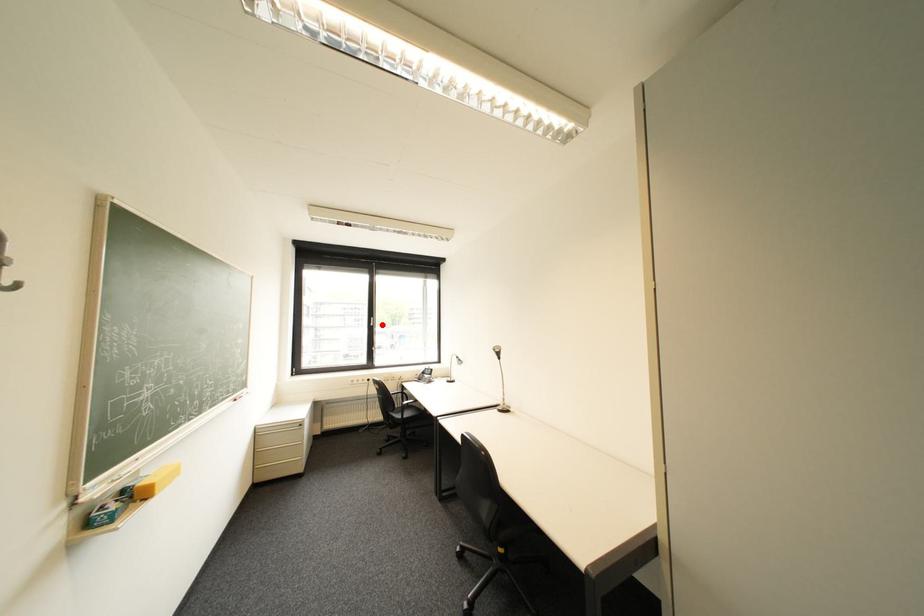
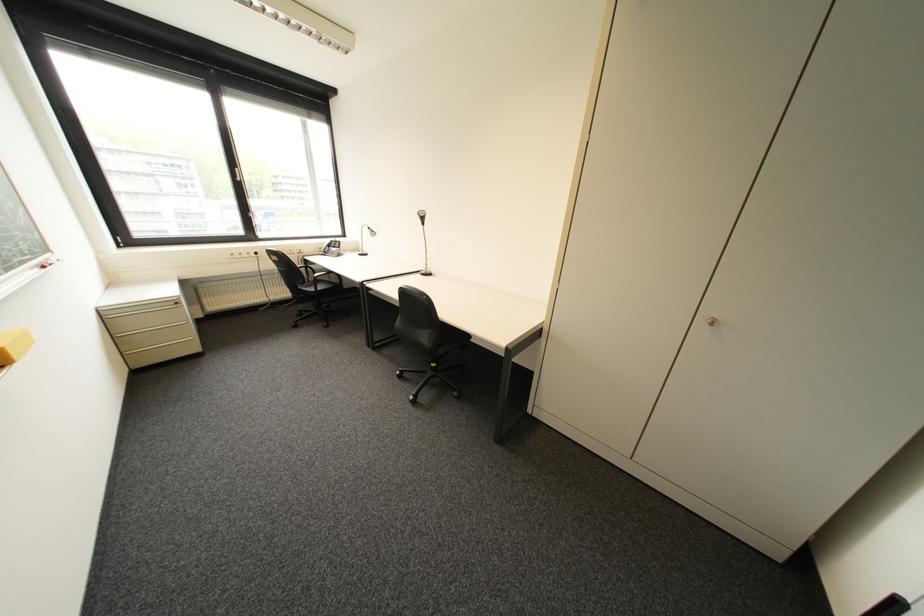
Question: A red point is marked in image1. In image2, is the corresponding 3D point closer to the camera or farther? Reply with the corresponding letter.

Choices:
 (A) The corresponding 3D point is closer.
 (B) The corresponding 3D point is farther.

Answer: (A)